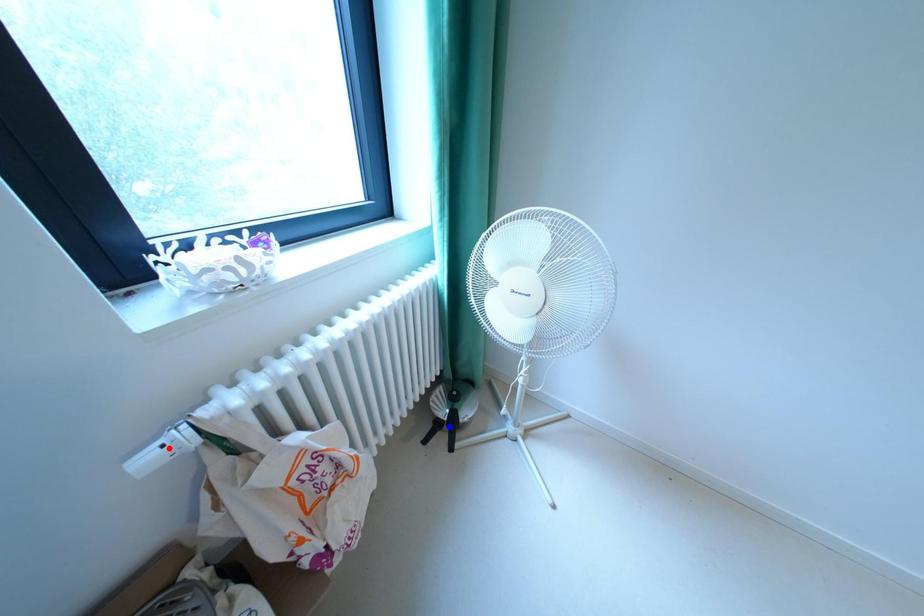
Question: In the image, two points are highlighted. Which point is nearer to the camera? Reply with the corresponding letter.

Choices:
 (A) blue point
 (B) red point

Answer: (B)